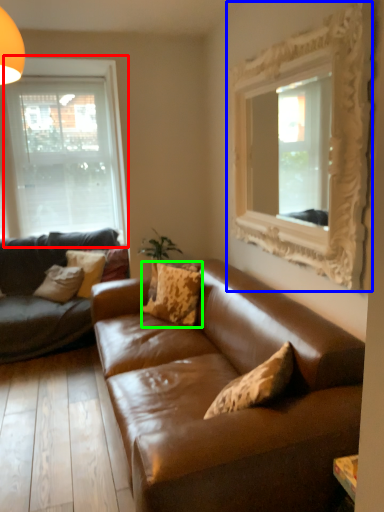
Question: Estimate the real-world distances between objects in this image. Which object is farther from window (highlighted by a red box), picture frame (highlighted by a blue box) or pillow (highlighted by a green box)?

Choices:
 (A) picture frame
 (B) pillow

Answer: (A)